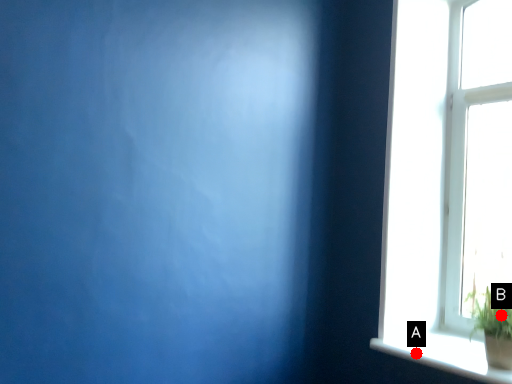
Question: Two points are circled on the image, labeled by A and B beside each circle. Which point appears farthest from the camera in this image?

Choices:
 (A) A is further
 (B) B is further

Answer: (A)